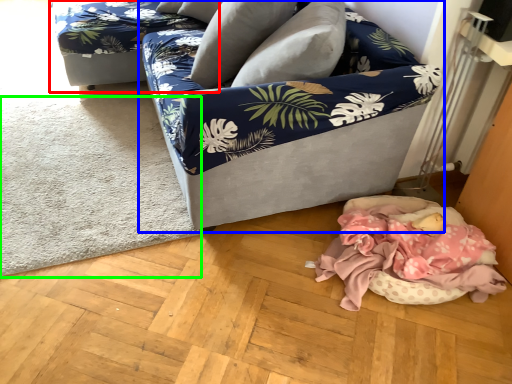
Question: Which object is positioned farthest from couch (highlighted by a red box)? Select from studio couch (highlighted by a blue box) and mat (highlighted by a green box).

Choices:
 (A) studio couch
 (B) mat

Answer: (A)